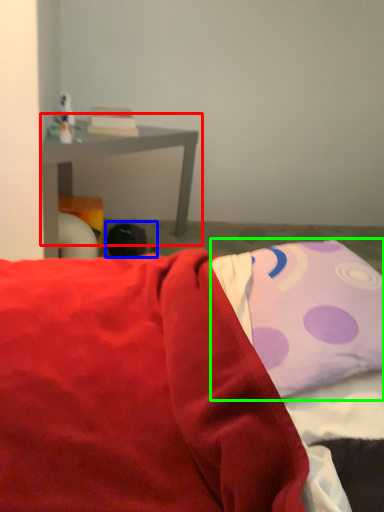
Question: Estimate the real-world distances between objects in this image. Which object is farther from table (highlighted by a red box), bean bag chair (highlighted by a blue box) or pillow (highlighted by a green box)?

Choices:
 (A) bean bag chair
 (B) pillow

Answer: (B)